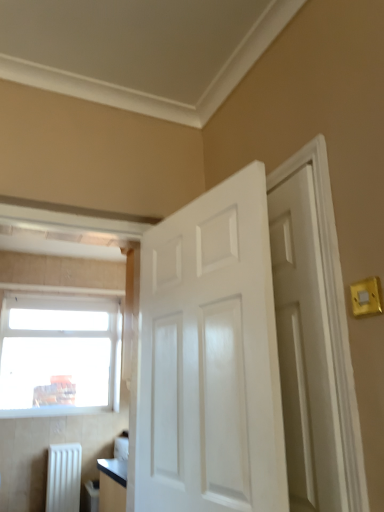
Question: From the image's perspective, would you say white glossy door at right, placed as the first door when sorted from right to left, is positioned over white matte radiator at lower left?

Choices:
 (A) no
 (B) yes

Answer: (B)

Question: Is white glossy door at right, placed as the first door when sorted from right to left, smaller than white matte radiator at lower left?

Choices:
 (A) yes
 (B) no

Answer: (A)

Question: Is white glossy door at right, which is counted as the 2th door, starting from the left, to the right of white matte radiator at lower left from the viewer's perspective?

Choices:
 (A) yes
 (B) no

Answer: (A)

Question: Is white glossy door at right, placed as the first door when sorted from right to left, outside of white matte radiator at lower left?

Choices:
 (A) yes
 (B) no

Answer: (A)

Question: Can you confirm if white glossy door at right, placed as the first door when sorted from right to left, is bigger than white matte radiator at lower left?

Choices:
 (A) no
 (B) yes

Answer: (A)

Question: Considering the positions of white glossy door at center, positioned as the 1th door in left-to-right order, and white matte radiator at lower left in the image, is white glossy door at center, positioned as the 1th door in left-to-right order, wider or thinner than white matte radiator at lower left?

Choices:
 (A) thin
 (B) wide

Answer: (A)

Question: From a real-world perspective, is white glossy door at center, the 2th door positioned from the right, positioned above or below white matte radiator at lower left?

Choices:
 (A) below
 (B) above

Answer: (B)

Question: Visually, is white glossy door at center, the 2th door positioned from the right, positioned to the left or to the right of white matte radiator at lower left?

Choices:
 (A) right
 (B) left

Answer: (A)

Question: From the image's perspective, is white glossy door at center, positioned as the 1th door in left-to-right order, located above or below white matte radiator at lower left?

Choices:
 (A) above
 (B) below

Answer: (A)

Question: Looking at their shapes, would you say transparent glass window at upper left is wider or thinner than white matte radiator at lower left?

Choices:
 (A) wide
 (B) thin

Answer: (B)

Question: Is point (16, 384) positioned closer to the camera than point (76, 502)?

Choices:
 (A) closer
 (B) farther

Answer: (B)

Question: Looking at the image, does transparent glass window at upper left seem bigger or smaller compared to white matte radiator at lower left?

Choices:
 (A) small
 (B) big

Answer: (B)

Question: Would you say transparent glass window at upper left is to the left or to the right of white matte radiator at lower left in the picture?

Choices:
 (A) right
 (B) left

Answer: (B)

Question: From a real-world perspective, is white glossy door at center, the 2th door positioned from the right, physically located above or below yellow plastic light switch at upper right?

Choices:
 (A) below
 (B) above

Answer: (A)

Question: Considering the positions of white glossy door at center, positioned as the 1th door in left-to-right order, and yellow plastic light switch at upper right in the image, is white glossy door at center, positioned as the 1th door in left-to-right order, taller or shorter than yellow plastic light switch at upper right?

Choices:
 (A) tall
 (B) short

Answer: (A)